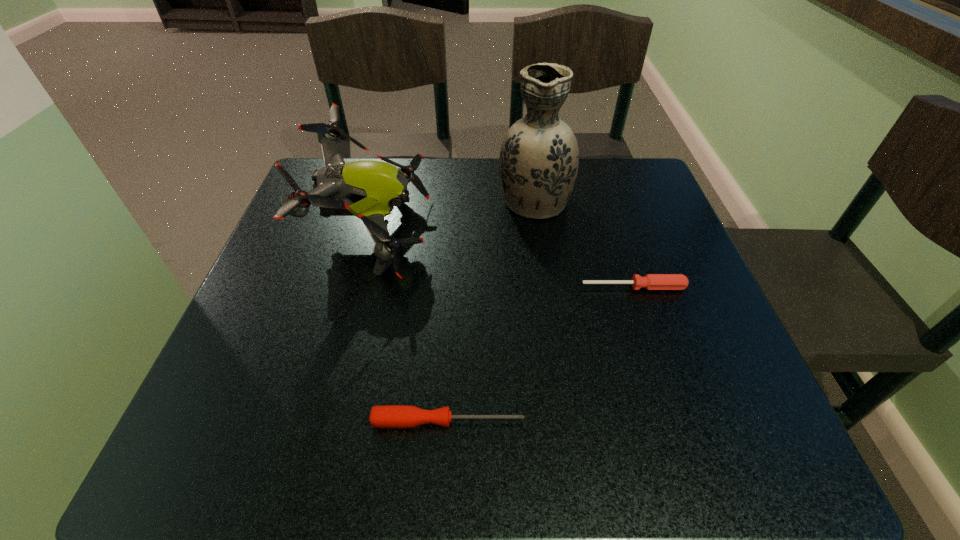
Locate an element on the screen. This screenshot has width=960, height=540. vase is located at coordinates (539, 158).

Identify the location of the second tallest object. (367, 189).

I want to click on the farther screwdriver, so click(x=651, y=281).

This screenshot has width=960, height=540. Identify the location of the left screwdriver. (388, 416).

I want to click on the nearest object, so click(388, 416).

Where is `vacant space situated 0.050m with the handle on the side of the tallest object`? Image resolution: width=960 pixels, height=540 pixels. vacant space situated 0.050m with the handle on the side of the tallest object is located at coordinates (529, 166).

Identify the location of vacant space located 0.090m with the handle on the side of the tallest object. The height and width of the screenshot is (540, 960). click(x=528, y=158).

Find the location of a particular element. The image size is (960, 540). free space located 0.050m with the handle on the side of the tallest object is located at coordinates (529, 166).

You are a GUI agent. You are given a task and a screenshot of the screen. Output one action in this format:
    pyautogui.click(x=<x>, y=<y>)
    Task: Click on the free space located on the front-facing side of the drone
    
    Given the screenshot: What is the action you would take?
    pyautogui.click(x=513, y=233)

Identify the location of vacant region located 0.150m on the front of the right screwdriver. (657, 357).